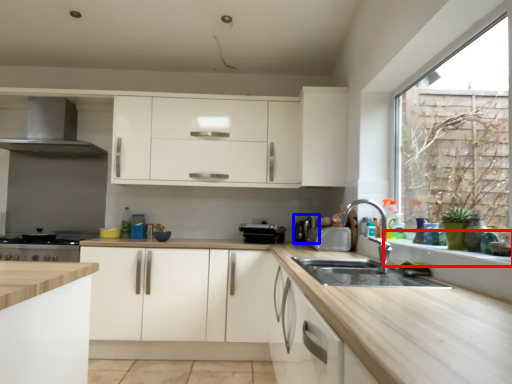
Question: Among these objects, which one is nearest to the camera, window sill (highlighted by a red box) or appliance (highlighted by a blue box)?

Choices:
 (A) window sill
 (B) appliance

Answer: (A)